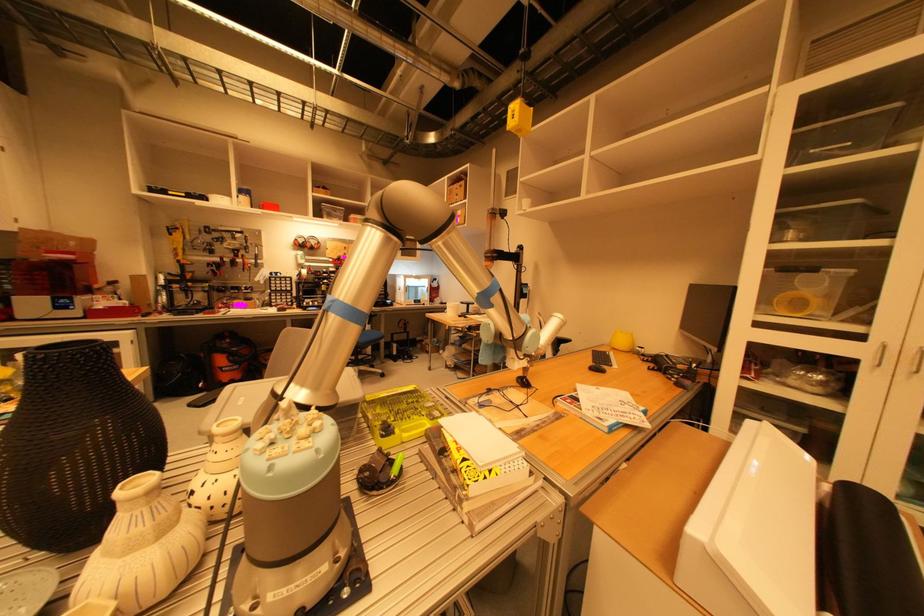
Identify the location of white striped vase. (141, 548).